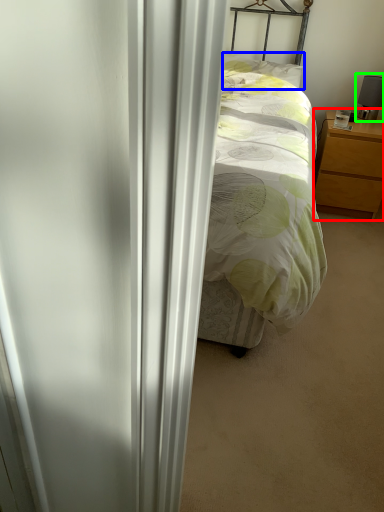
Question: Which is farther away from nightstand (highlighted by a red box)? pillow (highlighted by a blue box) or table lamp (highlighted by a green box)?

Choices:
 (A) pillow
 (B) table lamp

Answer: (A)